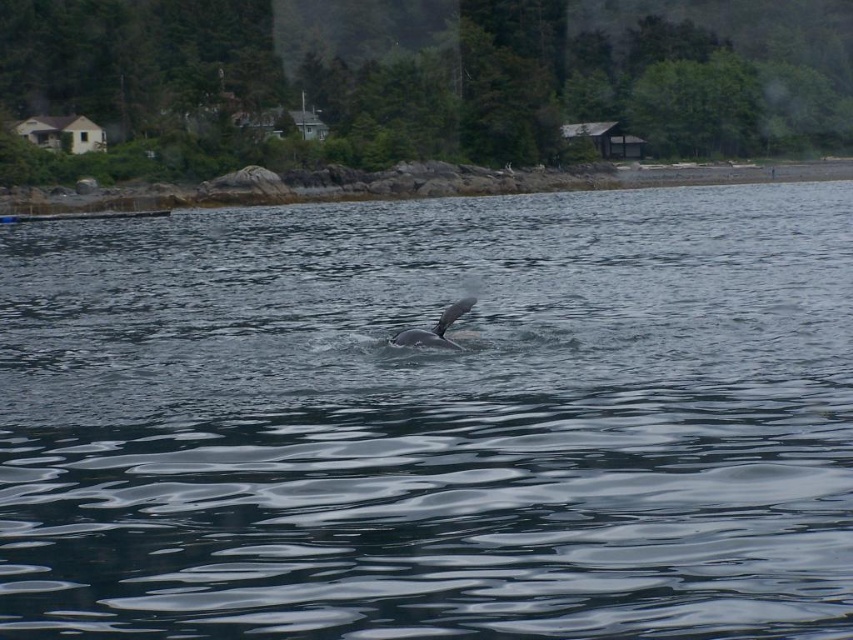
Is dark gray water at center further to camera compared to gray smooth whale at center?

No, it is not.

Is point (398, 305) more distant than point (421, 333)?

Yes, it is.

The image size is (853, 640). What are the coordinates of `dark gray water at center` in the screenshot? It's located at (432, 419).